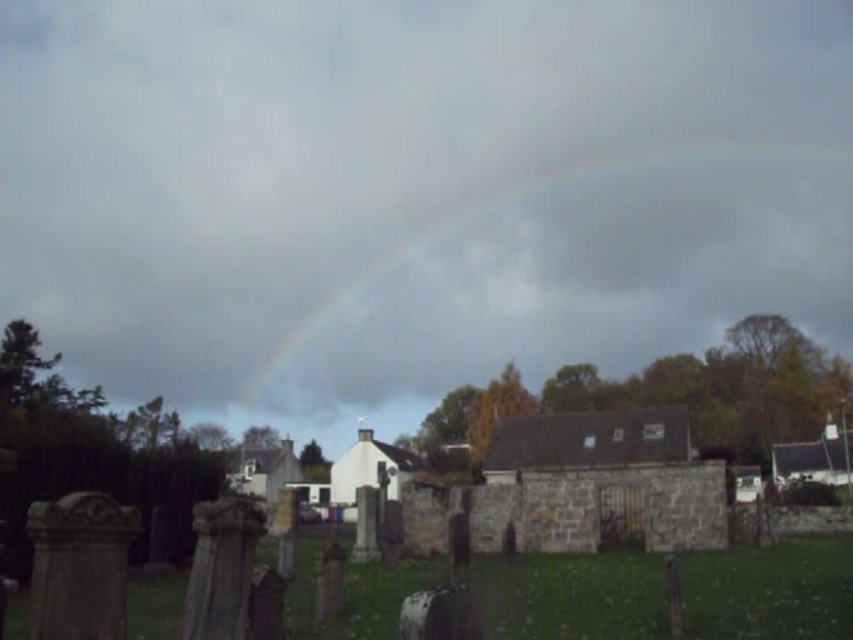
Is rainbow at upper center to the left of smooth stone gravestone at lower left from the viewer's perspective?

Incorrect, rainbow at upper center is not on the left side of smooth stone gravestone at lower left.

Does point (549, 236) lie behind point (41, 614)?

Yes, it is.

Is point (640, 296) behind point (35, 624)?

That is True.

At what (x,y) coordinates should I click in order to perform the action: click on rainbow at upper center. Please return your answer as a coordinate pair (x, y). This screenshot has width=853, height=640. Looking at the image, I should click on (585, 278).